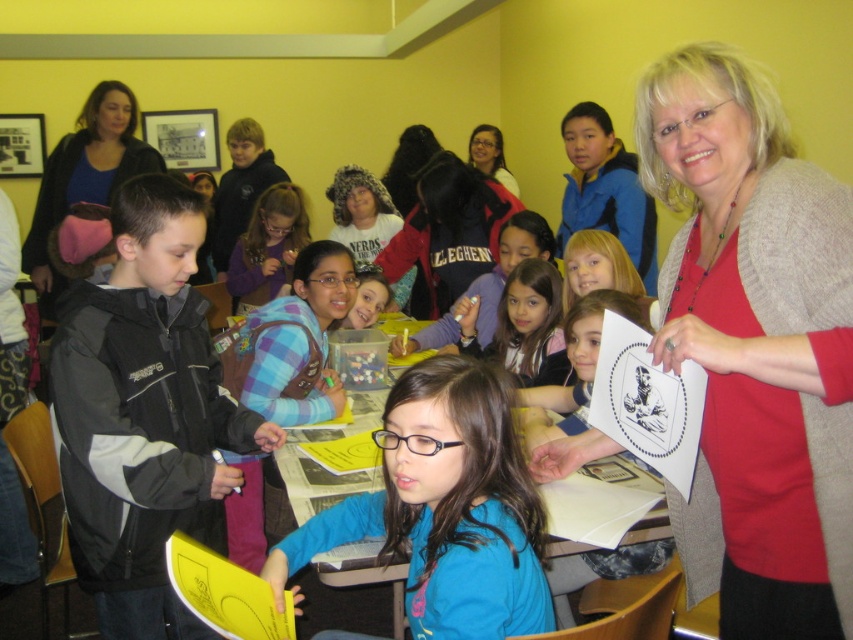
Does point (744, 516) lie in front of point (511, 364)?

Yes, point (744, 516) is closer to viewer.

Which is below, red sweater at upper right or matte blue shirt at center?

Positioned lower is red sweater at upper right.

Between point (805, 353) and point (521, 381), which one is positioned behind?

Point (521, 381)

Identify the location of red sweater at upper right. (755, 348).

Which is more to the right, black jacket at left or matte black glasses at center?

From the viewer's perspective, matte black glasses at center appears more on the right side.

Locate an element on the screen. Image resolution: width=853 pixels, height=640 pixels. black jacket at left is located at coordinates 144,413.

I want to click on black jacket at left, so click(144, 413).

Does blue matte shirt at center appear over matte blue shirt at center?

Actually, blue matte shirt at center is below matte blue shirt at center.

This screenshot has height=640, width=853. What do you see at coordinates (445, 508) in the screenshot?
I see `blue matte shirt at center` at bounding box center [445, 508].

In order to click on blue matte shirt at center in this screenshot , I will do `click(445, 508)`.